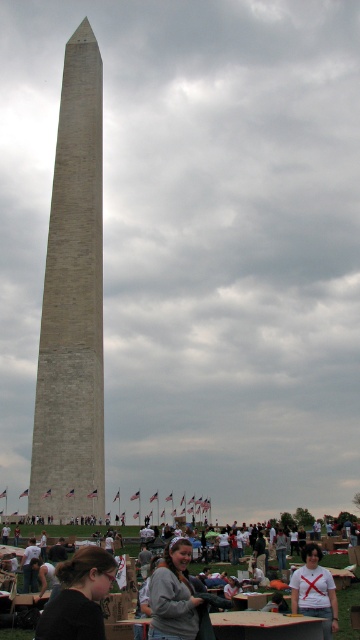
You are a photographer standing at the edge of the crowd. You want to take a photo that includes both the beige stone tower at center and the gray fabric jacket at lower center. Given that your camera has a maximum focal length of 50mm, which allows capturing objects up to 100 feet apart in the frame, will you be able to include both subjects in a single shot?

The beige stone tower at center and gray fabric jacket at lower center are 104.28 feet apart. Since the camera can only capture up to 100 feet, you won cannot include both in a single shot.

You are a photographer trying to capture a photo of the beige stone tower at center and the dark brown hair at lower left. Which object should you zoom in more on to ensure both are clearly visible in the photo?

You should zoom in more on the beige stone tower at center because it is thinner than the dark brown hair at lower left, so it requires more magnification to be clearly visible.